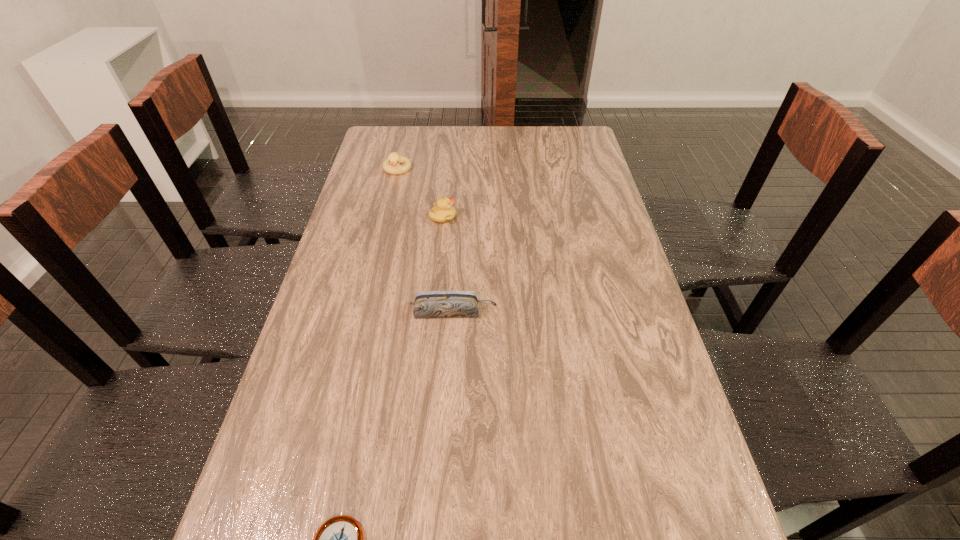
The height and width of the screenshot is (540, 960). What are the coordinates of `empty space between the nearer duckling and the farther duckling` in the screenshot? It's located at (420, 193).

Choose which object is the second nearest neighbor to the pencil box. Please provide its 2D coordinates. Your answer should be formatted as a tuple, i.e. [(x, y)], where the tuple contains the x and y coordinates of a point satisfying the conditions above.

[(340, 539)]

Identify which object is the second nearest to the pencil box. Please provide its 2D coordinates. Your answer should be formatted as a tuple, i.e. [(x, y)], where the tuple contains the x and y coordinates of a point satisfying the conditions above.

[(340, 539)]

I want to click on free space in the image that satisfies the following two spatial constraints: 1. on the back side of the third farthest object; 2. on the beak of the right duckling, so click(459, 217).

I want to click on blank space that satisfies the following two spatial constraints: 1. on the beak of the second farthest object; 2. on the back side of the second nearest object, so click(x=434, y=312).

You are a GUI agent. You are given a task and a screenshot of the screen. Output one action in this format:
    pyautogui.click(x=<x>, y=<y>)
    Task: Click on the free space that satisfies the following two spatial constraints: 1. at the beak of the farther duckling; 2. on the right side of the second nearest object
    Image resolution: width=960 pixels, height=540 pixels.
    Given the screenshot: What is the action you would take?
    pyautogui.click(x=364, y=312)

Find the location of a particular element. This screenshot has width=960, height=540. free space that satisfies the following two spatial constraints: 1. at the beak of the pencil box; 2. on the right side of the left duckling is located at coordinates click(x=364, y=312).

Identify the location of free region that satisfies the following two spatial constraints: 1. at the beak of the pencil box; 2. on the right side of the farthest object. (364, 312).